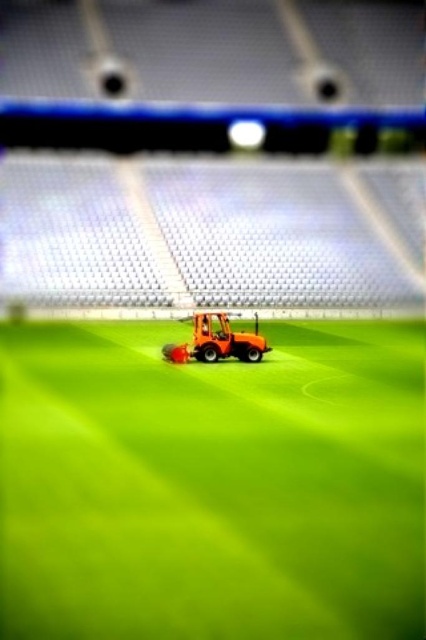
Find the location of a particular element. This screenshot has height=640, width=426. green smooth grass at center is located at coordinates (212, 484).

Between point (97, 515) and point (213, 344), which one is positioned behind?

Point (213, 344)

At what (x,y) coordinates should I click in order to perform the action: click on green smooth grass at center. Please return your answer as a coordinate pair (x, y). Looking at the image, I should click on (212, 484).